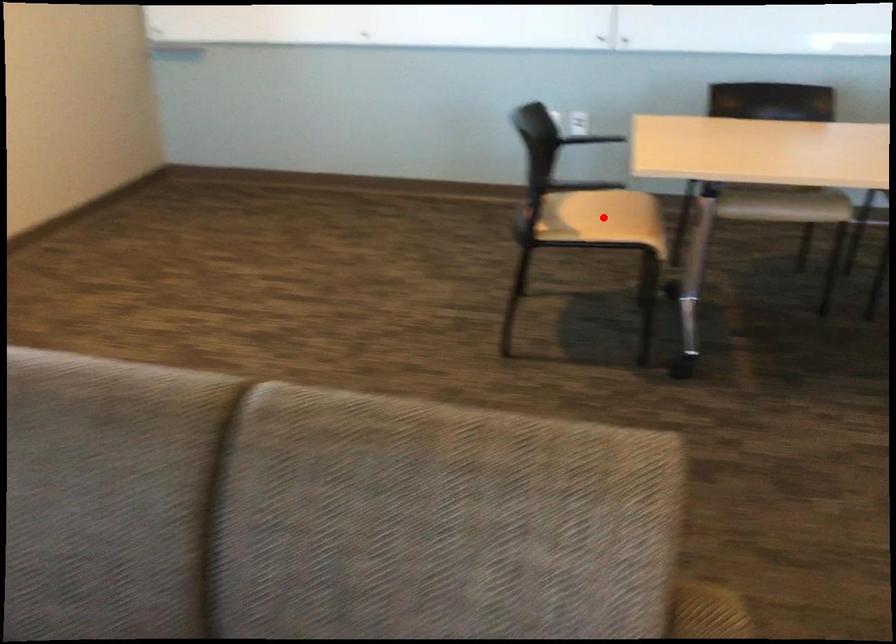
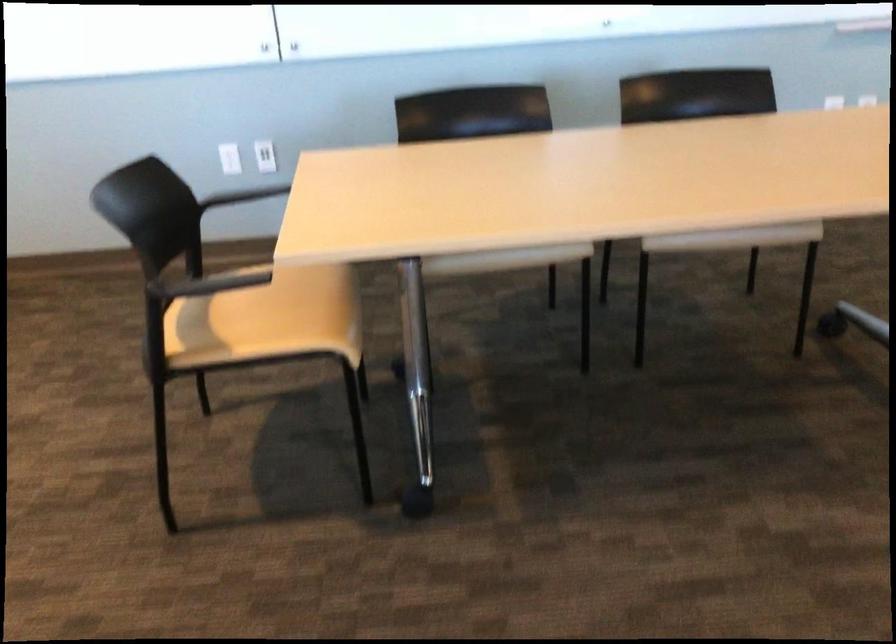
Find the pixel in the second image that matches the highlighted location in the first image.

(274, 315)